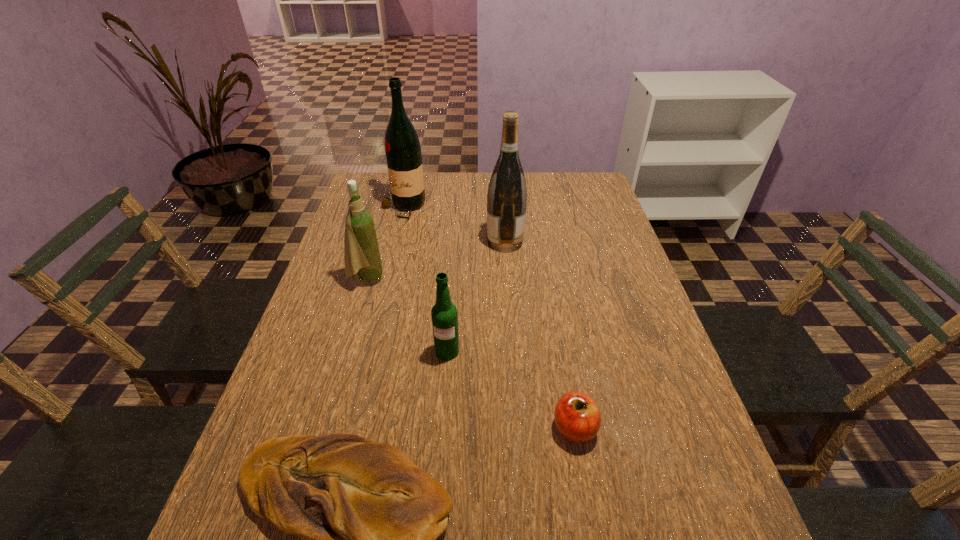
Locate which object ranks second in proximity to the fourth tallest object. Please provide its 2D coordinates. Your answer should be formatted as a tuple, i.e. [(x, y)], where the tuple contains the x and y coordinates of a point satisfying the conditions above.

[(577, 418)]

At what (x,y) coordinates should I click in order to perform the action: click on object that stands as the second closest to the bread. Please return your answer as a coordinate pair (x, y). This screenshot has height=540, width=960. Looking at the image, I should click on (444, 315).

Identify which wine bottle is the nearest to the third shortest object. Please provide its 2D coordinates. Your answer should be formatted as a tuple, i.e. [(x, y)], where the tuple contains the x and y coordinates of a point satisfying the conditions above.

[(362, 256)]

Select which wine bottle appears as the second closest to the third nearest object. Please provide its 2D coordinates. Your answer should be formatted as a tuple, i.e. [(x, y)], where the tuple contains the x and y coordinates of a point satisfying the conditions above.

[(507, 193)]

I want to click on vacant region that satisfies the following two spatial constraints: 1. on the label of the apple; 2. on the left side of the beer bottle, so click(442, 428).

Find the location of `free space that satisfies the following two spatial constraints: 1. on the label of the rightmost wine bottle; 2. on the label of the third shortest object`. free space that satisfies the following two spatial constraints: 1. on the label of the rightmost wine bottle; 2. on the label of the third shortest object is located at coordinates (513, 352).

Locate an element on the screen. This screenshot has width=960, height=540. vacant point that satisfies the following two spatial constraints: 1. on the label of the second nearest wine bottle; 2. on the right side of the apple is located at coordinates point(518,428).